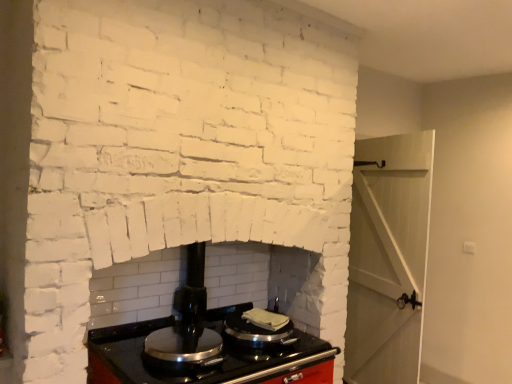
Where is `shiny black stove top at center`? This screenshot has height=384, width=512. shiny black stove top at center is located at coordinates (182, 348).

Describe the element at coordinates (182, 348) in the screenshot. This screenshot has width=512, height=384. I see `shiny black stove top at center` at that location.

Describe the element at coordinates (259, 328) in the screenshot. I see `metallic silver stove top at center` at that location.

The width and height of the screenshot is (512, 384). What are the coordinates of `metallic silver stove top at center` in the screenshot? It's located at (259, 328).

You are a GUI agent. You are given a task and a screenshot of the screen. Output one action in this format:
    pyautogui.click(x=<x>, y=<y>)
    Task: Click on the shiny black stove top at center
    
    Given the screenshot: What is the action you would take?
    pyautogui.click(x=182, y=348)

Which object is positioned more to the left, shiny black stove top at center or metallic silver stove top at center?

From the viewer's perspective, shiny black stove top at center appears more on the left side.

Is shiny black stove top at center positioned in front of metallic silver stove top at center?

Yes, the depth of shiny black stove top at center is less than that of metallic silver stove top at center.

Considering the positions of point (204, 356) and point (251, 316), is point (204, 356) closer or farther from the camera than point (251, 316)?

Point (204, 356) is closer to the camera than point (251, 316).

From the image's perspective, which is above, shiny black stove top at center or metallic silver stove top at center?

metallic silver stove top at center is shown above in the image.

From a real-world perspective, which is physically below, shiny black stove top at center or metallic silver stove top at center?

shiny black stove top at center.

Can you confirm if shiny black stove top at center is thinner than metallic silver stove top at center?

Yes.

Considering the sizes of shiny black stove top at center and metallic silver stove top at center in the image, is shiny black stove top at center taller or shorter than metallic silver stove top at center?

In the image, shiny black stove top at center appears to be shorter than metallic silver stove top at center.

Can you confirm if shiny black stove top at center is bigger than metallic silver stove top at center?

No, shiny black stove top at center is not bigger than metallic silver stove top at center.

Can we say shiny black stove top at center lies outside metallic silver stove top at center?

Yes.

Consider the image. Are shiny black stove top at center and metallic silver stove top at center beside each other?

No, shiny black stove top at center is not in contact with metallic silver stove top at center.

Is shiny black stove top at center facing away from metallic silver stove top at center?

No, shiny black stove top at center is not facing the opposite direction of metallic silver stove top at center.

You are a GUI agent. You are given a task and a screenshot of the screen. Output one action in this format:
    pyautogui.click(x=<x>, y=<y>)
    Task: Click on the kitchen appliance above the shiny black stove top at center (from the image's perspective)
    
    Given the screenshot: What is the action you would take?
    pyautogui.click(x=259, y=328)

Is metallic silver stove top at center to the left of shiny black stove top at center from the viewer's perspective?

No.

Between metallic silver stove top at center and shiny black stove top at center, which one is positioned in front?

Positioned in front is shiny black stove top at center.

Considering the points (279, 338) and (215, 355), which point is behind, point (279, 338) or point (215, 355)?

The point (279, 338) is behind.

From the image's perspective, between metallic silver stove top at center and shiny black stove top at center, which one is located above?

metallic silver stove top at center is shown above in the image.

From a real-world perspective, is metallic silver stove top at center positioned under shiny black stove top at center based on gravity?

No, from a real-world perspective, metallic silver stove top at center is not beneath shiny black stove top at center.

Which object is thinner, metallic silver stove top at center or shiny black stove top at center?

With smaller width is shiny black stove top at center.

In terms of height, does metallic silver stove top at center look taller or shorter compared to shiny black stove top at center?

metallic silver stove top at center is taller than shiny black stove top at center.

Is metallic silver stove top at center bigger than shiny black stove top at center?

Yes, metallic silver stove top at center is bigger than shiny black stove top at center.

Is metallic silver stove top at center inside the boundaries of shiny black stove top at center, or outside?

metallic silver stove top at center is located beyond the bounds of shiny black stove top at center.

Is metallic silver stove top at center positioned far away from shiny black stove top at center?

metallic silver stove top at center is near shiny black stove top at center, not far away.

Is metallic silver stove top at center positioned with its back to shiny black stove top at center?

No, metallic silver stove top at center's orientation is not away from shiny black stove top at center.

How far apart are metallic silver stove top at center and shiny black stove top at center?

metallic silver stove top at center is 9.48 inches from shiny black stove top at center.

In the image, there is a shiny black stove top at center. Where is `kitchen appliance above it (from the image's perspective)`? This screenshot has width=512, height=384. kitchen appliance above it (from the image's perspective) is located at coordinates (259, 328).

The width and height of the screenshot is (512, 384). Find the location of `kitchen appliance located above the shiny black stove top at center (from a real-world perspective)`. kitchen appliance located above the shiny black stove top at center (from a real-world perspective) is located at coordinates (259, 328).

Find the location of a particular element. Image resolution: width=512 pixels, height=384 pixels. appliance below the metallic silver stove top at center (from the image's perspective) is located at coordinates coord(182,348).